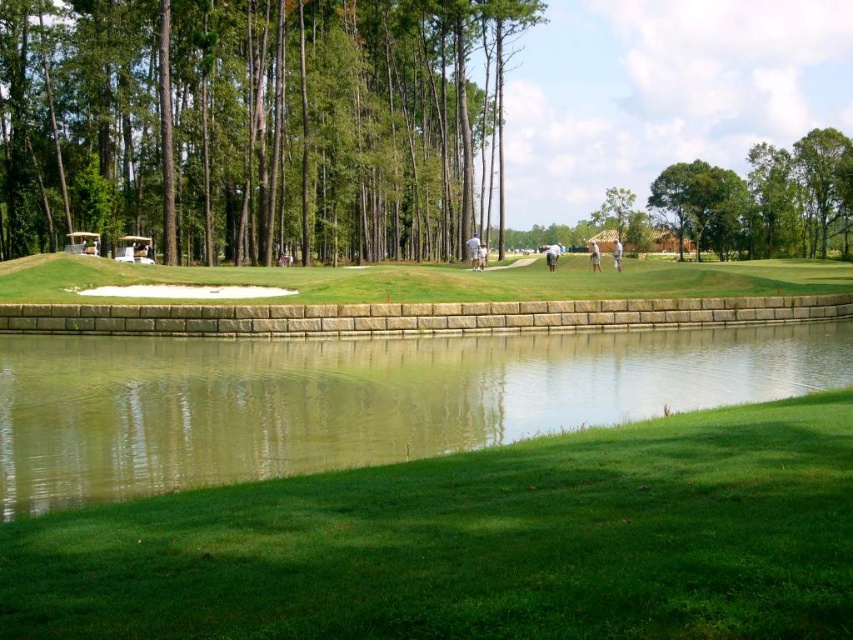
Question: Which object is the farthest from the green grassy golf course at center?

Choices:
 (A) light brown wood golf club at center
 (B) green leafy tree at center
 (C) white fabric golfer at center
 (D) white cotton shirt at center

Answer: (B)

Question: Which point is farther from the camera taking this photo?

Choices:
 (A) tap(804, 285)
 (B) tap(471, 262)

Answer: (B)

Question: Can you confirm if green grassy water at center is smaller than light brown wood golf club at center?

Choices:
 (A) no
 (B) yes

Answer: (A)

Question: Is green grassy water at center above light brown wood golf club at center?

Choices:
 (A) yes
 (B) no

Answer: (B)

Question: Where is light brown wood golf club at center located in relation to white cotton shirt at center in the image?

Choices:
 (A) above
 (B) below

Answer: (B)

Question: Which point is farther to the camera?

Choices:
 (A) (157, 186)
 (B) (474, 234)
 (C) (621, 248)

Answer: (B)